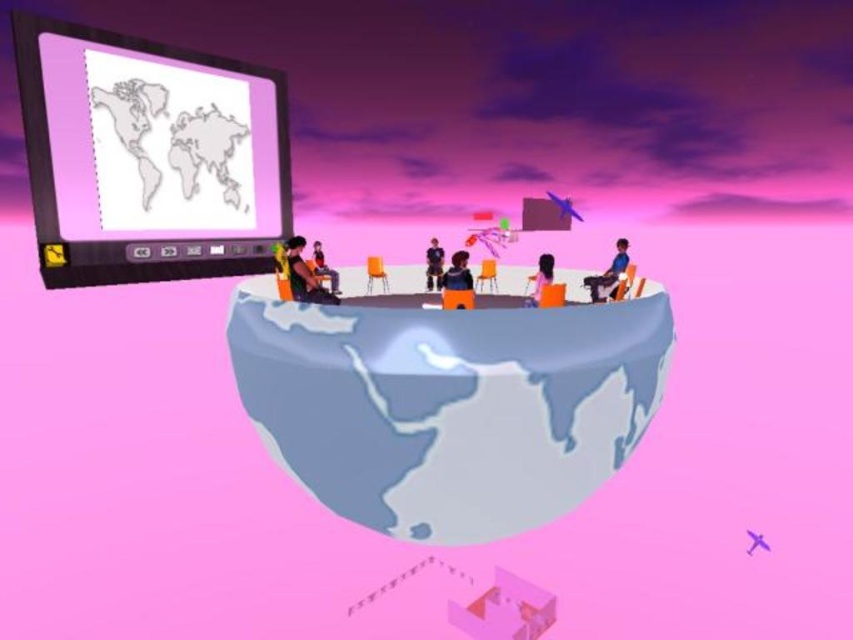
Based on the photo, is smooth gray globe at center shorter than matte plastic projector screen at upper left?

Incorrect, smooth gray globe at center's height does not fall short of matte plastic projector screen at upper left's.

What are the coordinates of `smooth gray globe at center` in the screenshot? It's located at (450, 404).

Is smooth gray globe at center below matte black jacket at center?

Correct, smooth gray globe at center is located below matte black jacket at center.

Which is more to the left, smooth gray globe at center or matte black jacket at center?

Positioned to the left is smooth gray globe at center.

Is point (544, 356) closer to camera compared to point (457, 266)?

Yes, point (544, 356) is closer to viewer.

You are a GUI agent. You are given a task and a screenshot of the screen. Output one action in this format:
    pyautogui.click(x=<x>, y=<y>)
    Task: Click on the smooth gray globe at center
    The height and width of the screenshot is (640, 853).
    Given the screenshot: What is the action you would take?
    pyautogui.click(x=450, y=404)

Who is more forward, (566, 419) or (529, 296)?

Point (566, 419) is more forward.

Which of these two, smooth gray globe at center or matte orange chair at center, stands shorter?

With less height is matte orange chair at center.

The width and height of the screenshot is (853, 640). What do you see at coordinates (450, 404) in the screenshot? I see `smooth gray globe at center` at bounding box center [450, 404].

Locate an element on the screen. This screenshot has height=640, width=853. smooth gray globe at center is located at coordinates (450, 404).